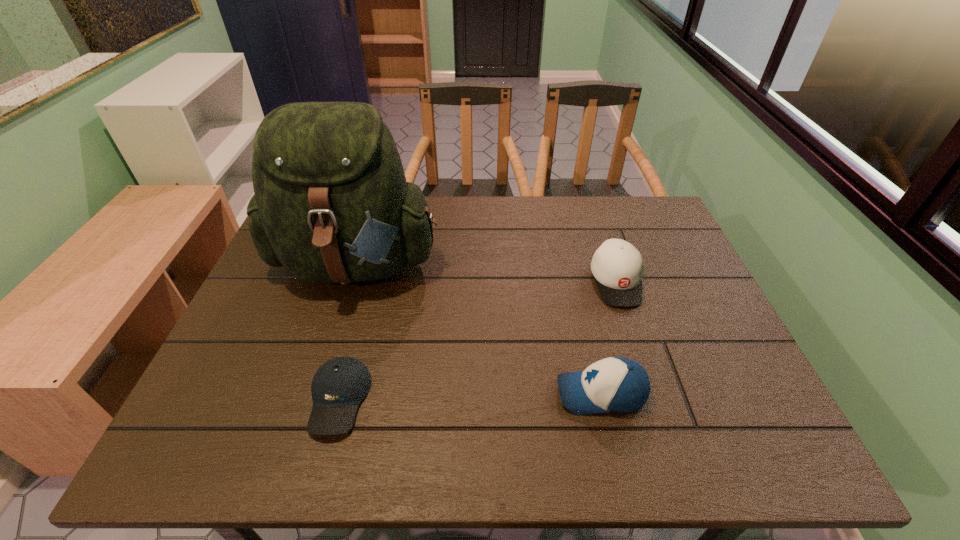
Where is `object present at the far left corner`? Image resolution: width=960 pixels, height=540 pixels. object present at the far left corner is located at coordinates (331, 204).

Locate an element on the screen. The image size is (960, 540). free space at the far edge of the desktop is located at coordinates (537, 206).

Locate an element on the screen. free space at the left edge is located at coordinates (276, 321).

The height and width of the screenshot is (540, 960). In the image, there is a desktop. Identify the location of vacant space at the right edge. (653, 293).

Identify the location of vacant space at the near left corner. Image resolution: width=960 pixels, height=540 pixels. (252, 423).

This screenshot has width=960, height=540. Identify the location of free space at the far right corner. (656, 233).

This screenshot has height=540, width=960. In order to click on vacant space that's between the tallest object and the shortest baseball cap in this screenshot , I will do `click(348, 330)`.

Identify the location of vacant space in between the tallest object and the farthest baseball cap. (487, 271).

Identify the location of free space between the tallest object and the farthest baseball cap. This screenshot has width=960, height=540. (487, 271).

Choose which object is the third nearest neighbor to the tallest object. Please provide its 2D coordinates. Your answer should be formatted as a tuple, i.e. [(x, y)], where the tuple contains the x and y coordinates of a point satisfying the conditions above.

[(617, 266)]